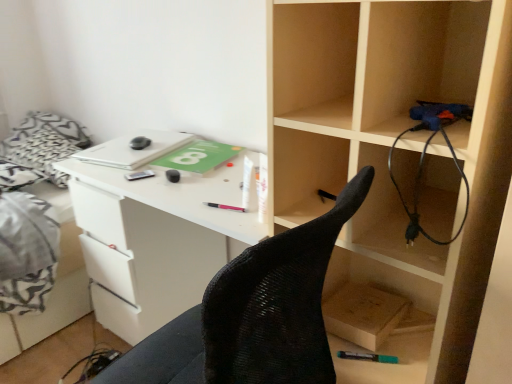
This screenshot has height=384, width=512. What are the coordinates of `vacant space that is in between pink plastic pen at center, placed as the 3th stationery when sorted from back to front, and black rubber mouse at center, the third stationery positioned from the right` in the screenshot? It's located at (196, 191).